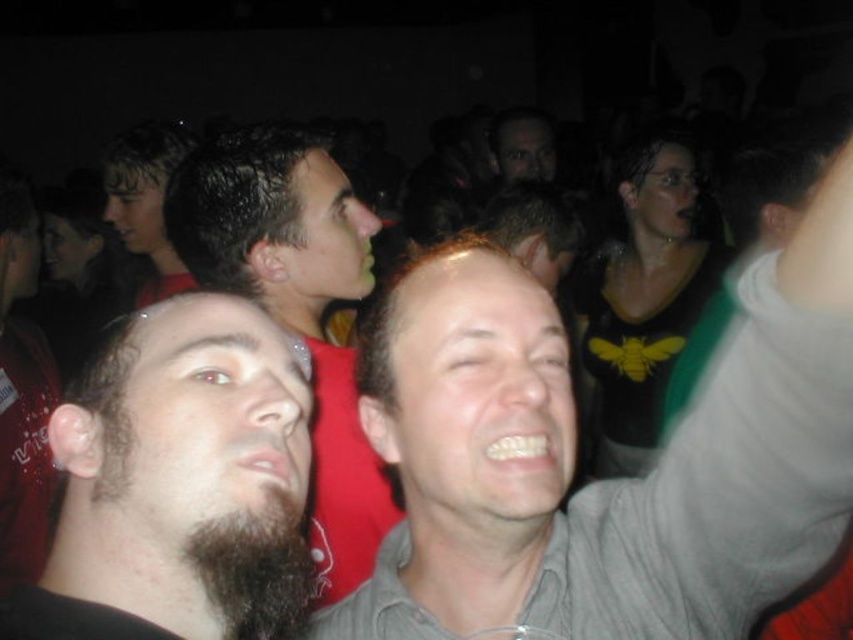
Consider the image. Between dark brown hair at center and dark brown hair at upper left, which one has less height?

Standing shorter between the two is dark brown hair at upper left.

Looking at this image, is dark brown hair at center above dark brown hair at upper left?

No, dark brown hair at center is not above dark brown hair at upper left.

Who is more distant from viewer, (352, 556) or (132, 170)?

Point (132, 170)

This screenshot has height=640, width=853. I want to click on dark brown hair at center, so click(x=294, y=304).

Is dark brown beard at left smaller than dark brown fuzzy beard at lower left?

Incorrect, dark brown beard at left is not smaller in size than dark brown fuzzy beard at lower left.

Between point (189, 292) and point (230, 602), which one is positioned in front?

Point (230, 602)

Locate an element on the screen. dark brown beard at left is located at coordinates (180, 484).

Is the position of gray matte shirt at center more distant than that of black matte shirt at upper right?

No, gray matte shirt at center is in front of black matte shirt at upper right.

The image size is (853, 640). What do you see at coordinates (599, 481) in the screenshot?
I see `gray matte shirt at center` at bounding box center [599, 481].

This screenshot has height=640, width=853. Find the location of `gray matte shirt at center`. gray matte shirt at center is located at coordinates (599, 481).